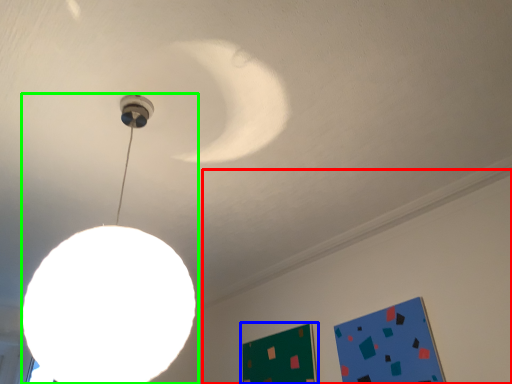
Question: Which is nearer to the backdrop (highlighted by a red box)? bulletin board (highlighted by a blue box) or lamp (highlighted by a green box).

Choices:
 (A) bulletin board
 (B) lamp

Answer: (A)